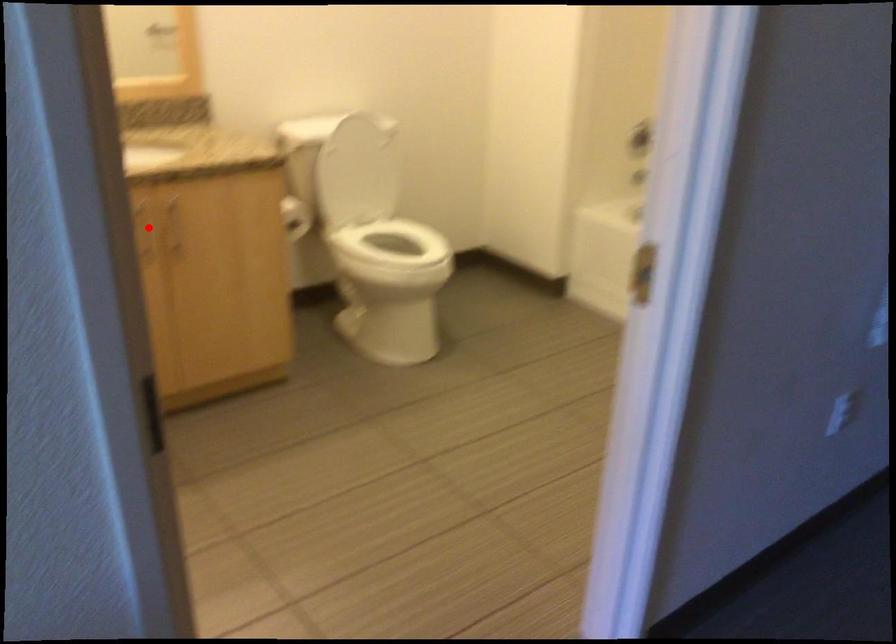
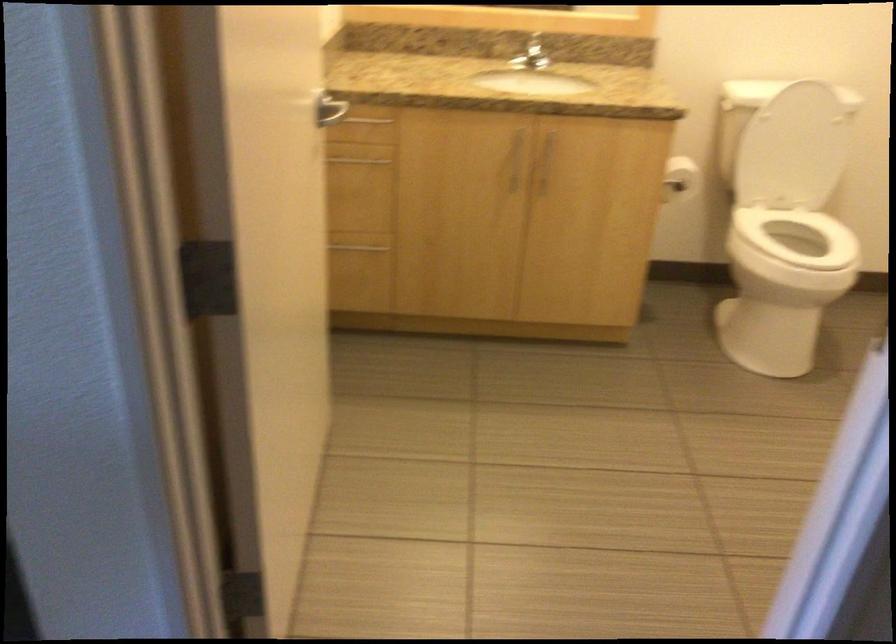
Where in the second image is the point corresponding to the highlighted location from the first image?

(518, 158)